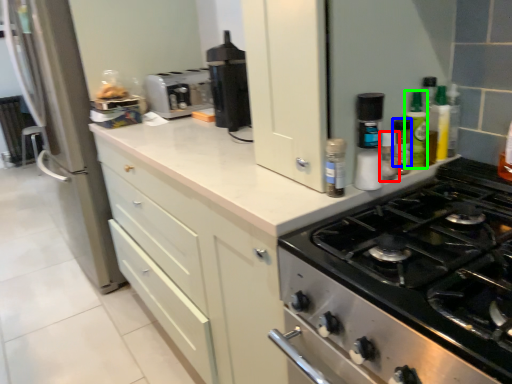
Question: Which object is positioned farthest from bottle (highlighted by a red box)? Select from bottle (highlighted by a blue box) and bottle (highlighted by a green box).

Choices:
 (A) bottle
 (B) bottle

Answer: (B)